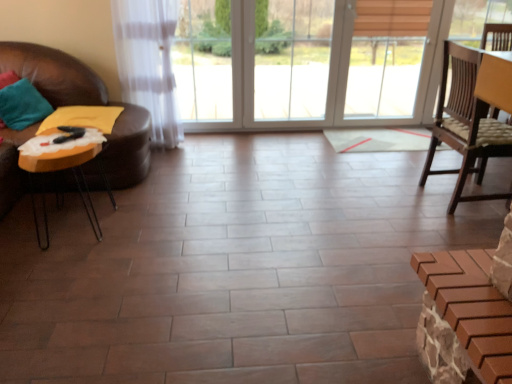
This screenshot has width=512, height=384. What are the coordinates of `teal fabric pillow at left` in the screenshot? It's located at (22, 105).

The height and width of the screenshot is (384, 512). What do you see at coordinates (22, 105) in the screenshot?
I see `teal fabric pillow at left` at bounding box center [22, 105].

This screenshot has width=512, height=384. Find the location of `orange glossy table at left`. orange glossy table at left is located at coordinates (73, 175).

This screenshot has height=384, width=512. What do you see at coordinates (73, 175) in the screenshot?
I see `orange glossy table at left` at bounding box center [73, 175].

I want to click on teal fabric pillow at left, so click(x=22, y=105).

Can you confirm if teal fabric pillow at left is positioned to the right of orange glossy table at left?

Incorrect, teal fabric pillow at left is not on the right side of orange glossy table at left.

Based on the photo, which is in front, teal fabric pillow at left or orange glossy table at left?

orange glossy table at left is closer to the camera.

Which is in front, point (19, 99) or point (57, 165)?

Point (57, 165)

From the image's perspective, does teal fabric pillow at left appear lower than orange glossy table at left?

No, from the image's perspective, teal fabric pillow at left is not beneath orange glossy table at left.

From a real-world perspective, which is physically below, teal fabric pillow at left or orange glossy table at left?

orange glossy table at left is physically lower.

Between teal fabric pillow at left and orange glossy table at left, which one has larger width?

Wider between the two is orange glossy table at left.

In terms of height, does teal fabric pillow at left look taller or shorter compared to orange glossy table at left?

teal fabric pillow at left is shorter than orange glossy table at left.

Considering the sizes of objects teal fabric pillow at left and orange glossy table at left in the image provided, who is bigger, teal fabric pillow at left or orange glossy table at left?

orange glossy table at left.

Is teal fabric pillow at left positioned beyond the bounds of orange glossy table at left?

Yes, teal fabric pillow at left is located beyond the bounds of orange glossy table at left.

Is teal fabric pillow at left with orange glossy table at left?

No, teal fabric pillow at left is not in contact with orange glossy table at left.

Is teal fabric pillow at left oriented away from orange glossy table at left?

No, teal fabric pillow at left's orientation is not away from orange glossy table at left.

How different are the orientations of teal fabric pillow at left and orange glossy table at left in degrees?

25.9 degrees separate the facing orientations of teal fabric pillow at left and orange glossy table at left.

The height and width of the screenshot is (384, 512). Identify the location of pillow that is on the left side of orange glossy table at left. click(22, 105).

Does orange glossy table at left appear on the right side of teal fabric pillow at left?

Yes.

Between orange glossy table at left and teal fabric pillow at left, which one is positioned behind?

Positioned behind is teal fabric pillow at left.

Which is behind, point (51, 152) or point (41, 109)?

The point (41, 109) is more distant.

From the image's perspective, is orange glossy table at left located beneath teal fabric pillow at left?

Yes.

From a real-world perspective, between orange glossy table at left and teal fabric pillow at left, who is vertically higher?

In real-world perspective, teal fabric pillow at left is above.

Considering the sizes of orange glossy table at left and teal fabric pillow at left in the image, is orange glossy table at left wider or thinner than teal fabric pillow at left?

orange glossy table at left is wider than teal fabric pillow at left.

Considering the sizes of objects orange glossy table at left and teal fabric pillow at left in the image provided, who is shorter, orange glossy table at left or teal fabric pillow at left?

Standing shorter between the two is teal fabric pillow at left.

Between orange glossy table at left and teal fabric pillow at left, which one has smaller size?

teal fabric pillow at left.

Is orange glossy table at left not inside teal fabric pillow at left?

Absolutely, orange glossy table at left is external to teal fabric pillow at left.

Are orange glossy table at left and teal fabric pillow at left far apart?

No, orange glossy table at left is not far from teal fabric pillow at left.

Is orange glossy table at left facing away from teal fabric pillow at left?

orange glossy table at left is not turned away from teal fabric pillow at left.

What's the angular difference between orange glossy table at left and teal fabric pillow at left's facing directions?

The angular difference between orange glossy table at left and teal fabric pillow at left is 25.9 degrees.

Identify the location of table on the right of teal fabric pillow at left. This screenshot has height=384, width=512. (73, 175).

Locate an element on the screen. The image size is (512, 384). table below the teal fabric pillow at left (from the image's perspective) is located at coordinates (73, 175).

Where is `pillow above the orange glossy table at left (from a real-world perspective)`? pillow above the orange glossy table at left (from a real-world perspective) is located at coordinates (22, 105).